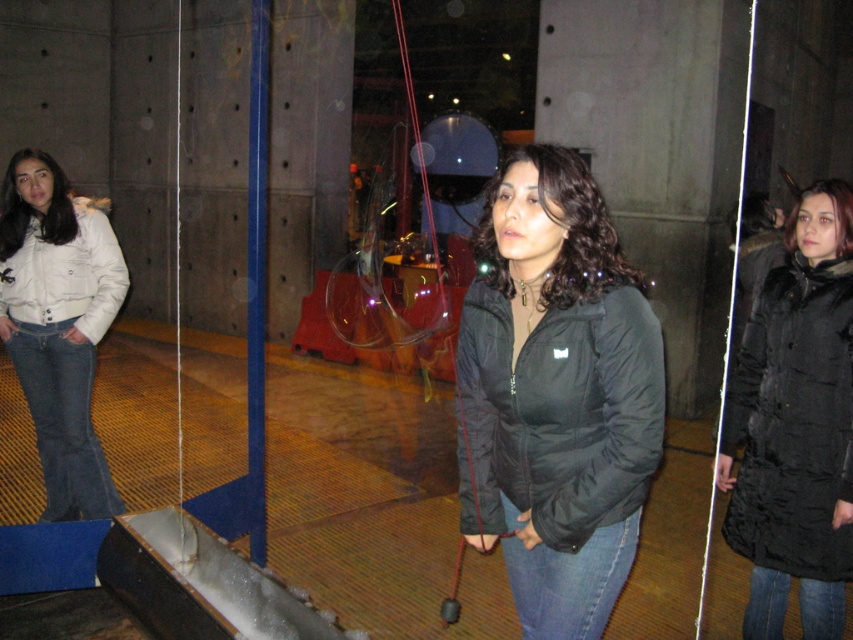
Question: Can you confirm if black puffy jacket at center is positioned above white cotton jacket at left?

Choices:
 (A) no
 (B) yes

Answer: (A)

Question: In this image, where is black puffy coat at right located relative to matte black coat at lower right?

Choices:
 (A) right
 (B) left

Answer: (B)

Question: Which point appears closest to the camera in this image?

Choices:
 (A) (51, 278)
 (B) (105, 538)

Answer: (B)

Question: Which object is farther from the camera taking this photo?

Choices:
 (A) black puffy coat at right
 (B) black puffy jacket at center

Answer: (A)

Question: Is black matte jacket at center smaller than white matte jacket at left?

Choices:
 (A) no
 (B) yes

Answer: (B)

Question: Which of the following is the farthest from the observer?

Choices:
 (A) white cotton jacket at left
 (B) black puffy jacket at center
 (C) transparent glass at lower center
 (D) black matte jacket at center

Answer: (A)